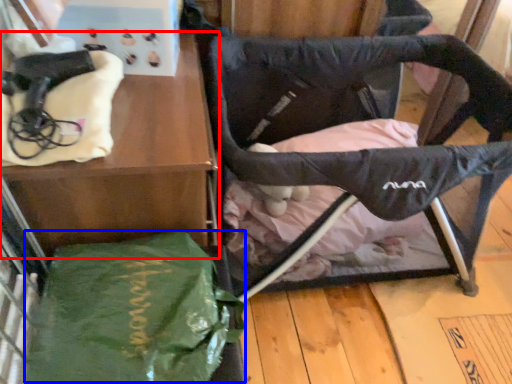
Question: Which object is further to the camera taking this photo, furniture (highlighted by a red box) or tote bag (highlighted by a blue box)?

Choices:
 (A) furniture
 (B) tote bag

Answer: (A)